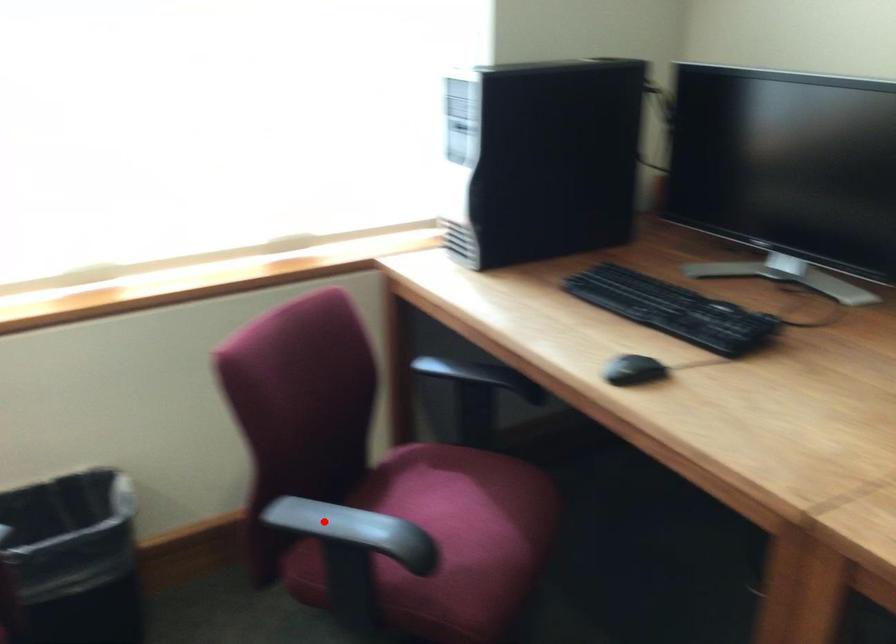
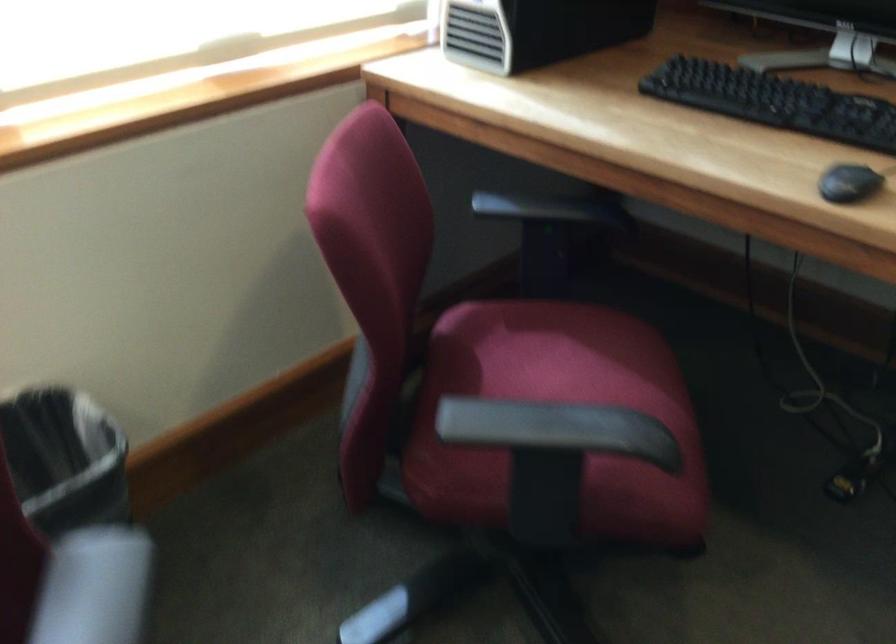
The point at the highlighted location is marked in the first image. Where is the corresponding point in the second image?

(528, 424)